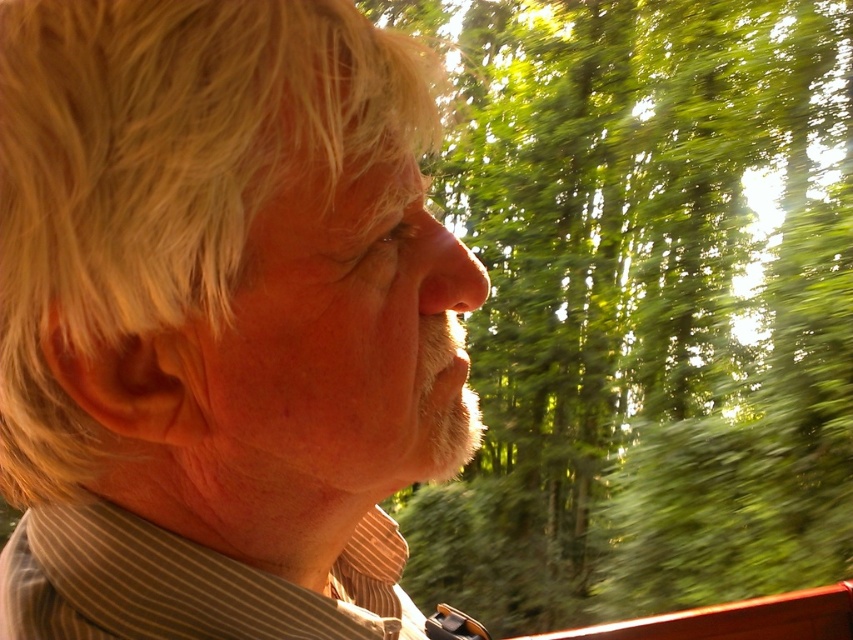
Question: Does light brown striped shirt at center appear on the right side of green leafy trees at upper right?

Choices:
 (A) no
 (B) yes

Answer: (A)

Question: Which point is closer to the camera taking this photo?

Choices:
 (A) (627, 193)
 (B) (387, 273)

Answer: (B)

Question: Does light brown striped shirt at center appear on the right side of green leafy trees at upper right?

Choices:
 (A) no
 (B) yes

Answer: (A)

Question: Is light brown striped shirt at center in front of green leafy trees at upper right?

Choices:
 (A) yes
 (B) no

Answer: (A)

Question: Which object is closer to the camera taking this photo?

Choices:
 (A) green leafy trees at upper right
 (B) light brown striped shirt at center

Answer: (B)

Question: Which point is closer to the camera?

Choices:
 (A) green leafy trees at upper right
 (B) light brown striped shirt at center

Answer: (B)